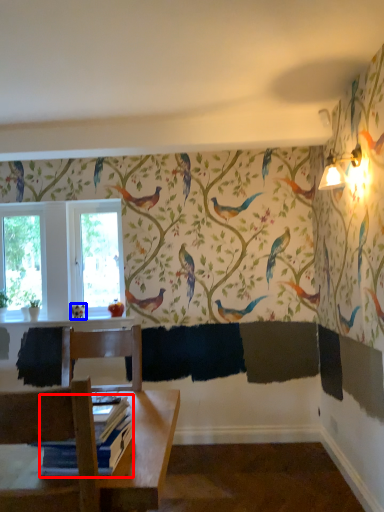
Question: Which object is closer to the camera taking this photo, book (highlighted by a red box) or bird (highlighted by a blue box)?

Choices:
 (A) book
 (B) bird

Answer: (A)